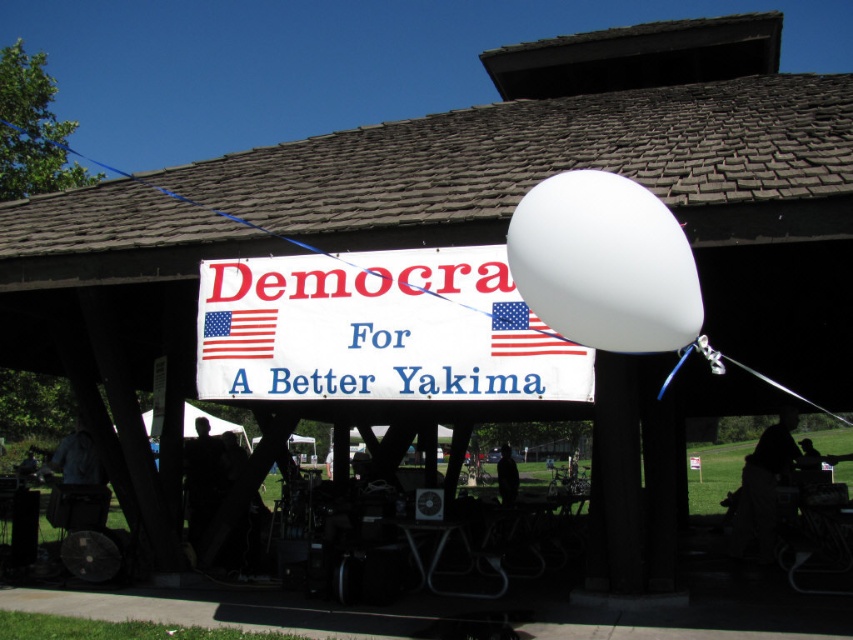
You are standing in front of the wooden pavilion and want to read the text on the white paper sign at center and the american flag at center. Which object is closer to you?

The white paper sign at center is closer to you than the american flag at center.

You are organizing an event and need to place a new sign to the right of the american flag at center. Can you do that without moving the existing white paper sign at center?

The white paper sign at center is positioned on the left side of the american flag at center, so to place a new sign to the right of the american flag at center, you would need to move the existing white paper sign at center to the left to make space.